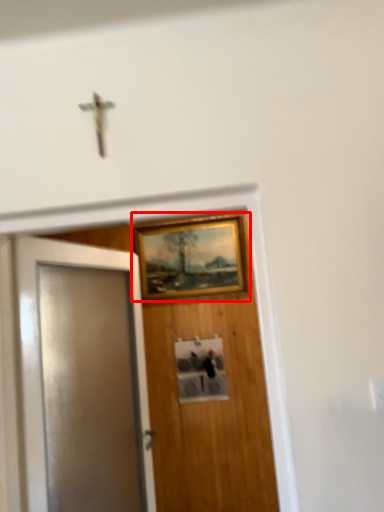
Question: Observing the image, what is the correct spatial positioning of picture frame (annotated by the red box) in reference to door?

Choices:
 (A) left
 (B) right

Answer: (B)